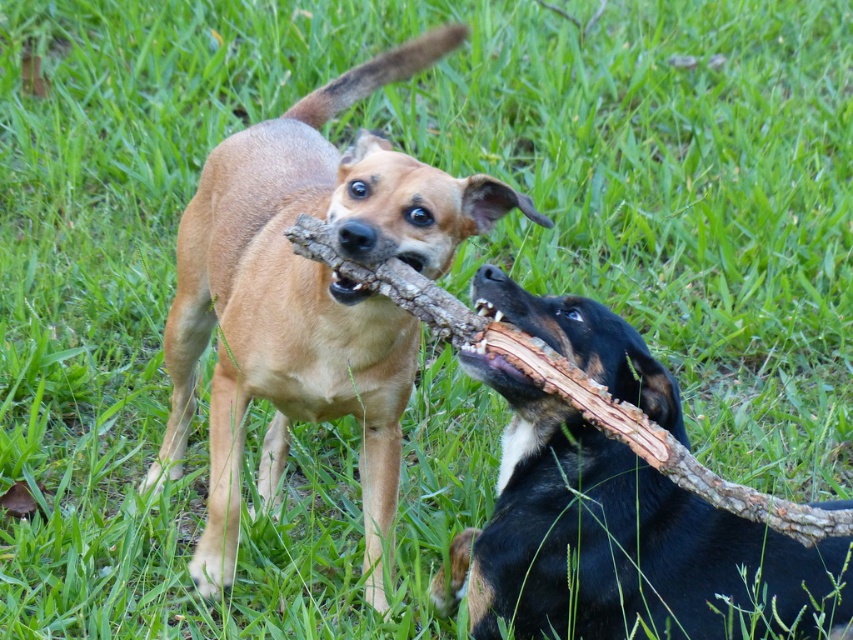
Question: Can you confirm if brown fur dog at center is positioned above black smooth dog at lower right?

Choices:
 (A) no
 (B) yes

Answer: (B)

Question: Is brown fur dog at center below black smooth dog at lower right?

Choices:
 (A) no
 (B) yes

Answer: (A)

Question: Can you confirm if brown fur dog at center is thinner than black smooth dog at lower right?

Choices:
 (A) no
 (B) yes

Answer: (A)